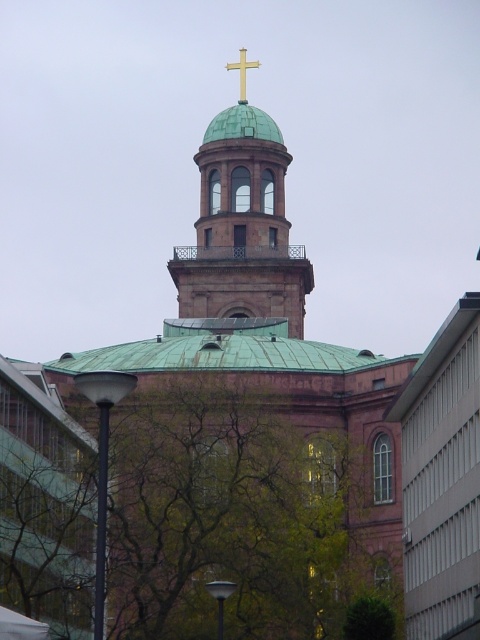
Question: Is green leafy tree at center above gold metallic cross at upper center?

Choices:
 (A) no
 (B) yes

Answer: (A)

Question: Can you confirm if green copper dome at upper center is positioned below gold metallic cross at upper center?

Choices:
 (A) no
 (B) yes

Answer: (B)

Question: Which point is closer to the camera?

Choices:
 (A) green copper dome at upper center
 (B) green leafy tree at center
 (C) gold metallic cross at upper center

Answer: (B)

Question: Which point appears farthest from the camera in this image?

Choices:
 (A) (233, 484)
 (B) (233, 129)
 (C) (241, 88)

Answer: (C)

Question: Among these objects, which one is farthest from the camera?

Choices:
 (A) green copper dome at upper center
 (B) green leafy tree at center

Answer: (A)

Question: Does green leafy tree at center have a lesser width compared to gold metallic cross at upper center?

Choices:
 (A) yes
 (B) no

Answer: (B)